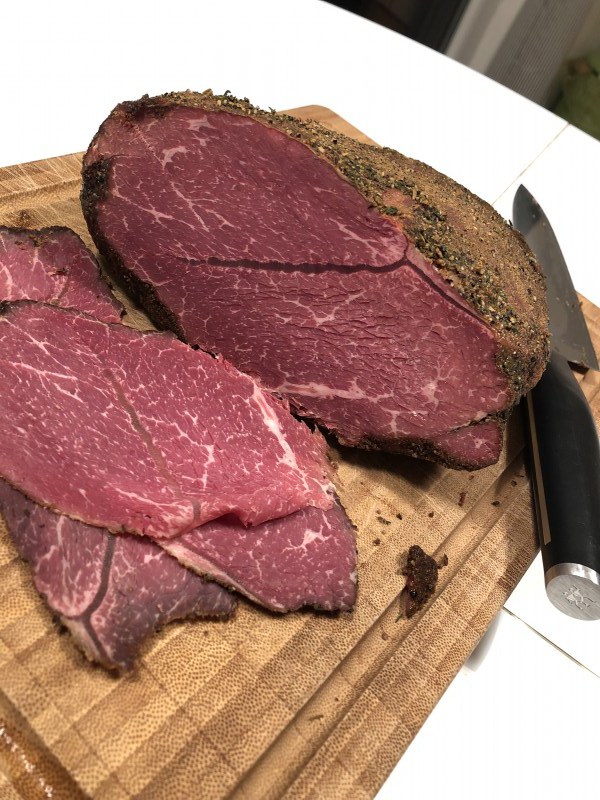
What are the coordinates of `wall` in the screenshot? It's located at (592, 585).